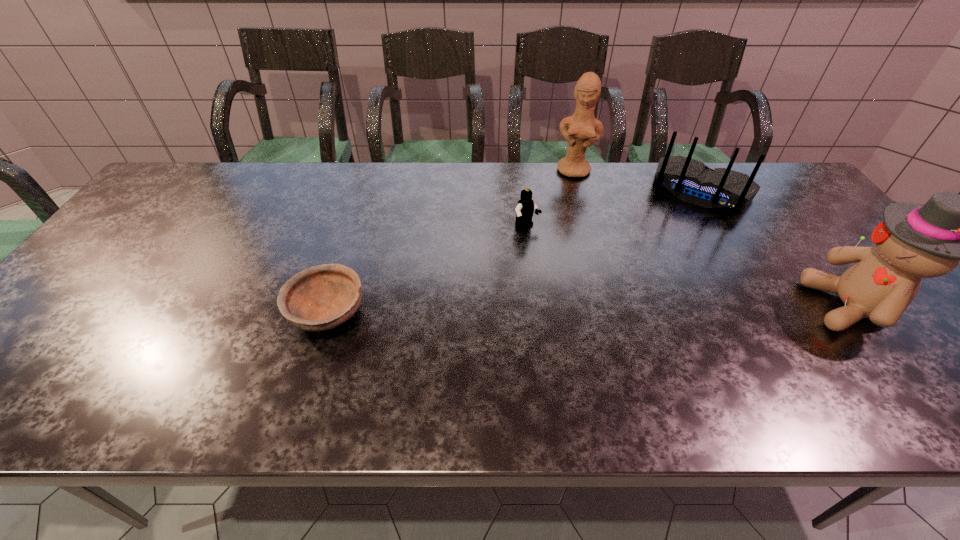
Locate an element on the screen. The image size is (960, 540). the shortest object is located at coordinates (322, 297).

The width and height of the screenshot is (960, 540). I want to click on bowl, so click(322, 297).

Where is `rag_doll`? This screenshot has height=540, width=960. rag_doll is located at coordinates (914, 241).

Find the location of a particular element. Image resolution: width=960 pixels, height=540 pixels. Lego is located at coordinates (525, 208).

Locate an element on the screen. The image size is (960, 540). the fourth object from right to left is located at coordinates (525, 208).

What are the coordinates of `figurine` in the screenshot? It's located at (585, 130).

In order to click on router in this screenshot , I will do `click(690, 180)`.

Where is `vacant space located 0.070m on the left of the shortest object`? vacant space located 0.070m on the left of the shortest object is located at coordinates (258, 313).

The image size is (960, 540). I want to click on vacant region located on the front-facing side of the rag_doll, so click(x=683, y=306).

Locate an element on the screen. The height and width of the screenshot is (540, 960). vacant position located 0.390m on the front-facing side of the rag_doll is located at coordinates (644, 306).